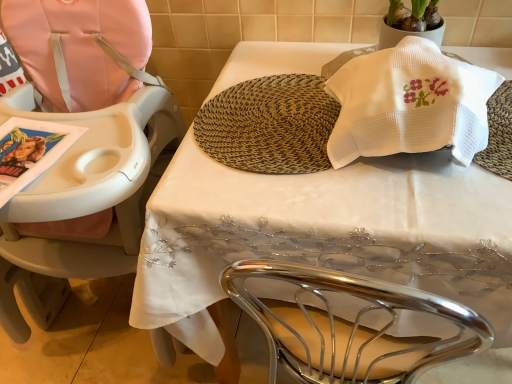
Locate an element on the screen. vacant space in front of brown woven mat at center is located at coordinates (328, 200).